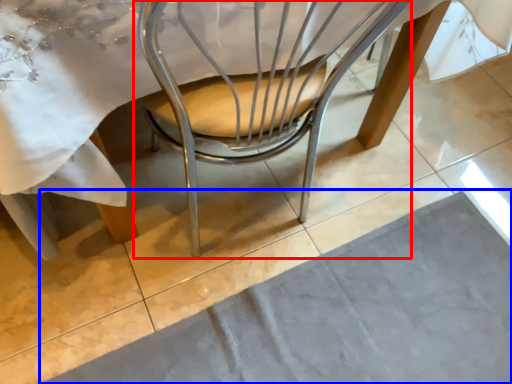
Question: Which object is further to the camera taking this photo, chair (highlighted by a red box) or place mat (highlighted by a blue box)?

Choices:
 (A) chair
 (B) place mat

Answer: (B)